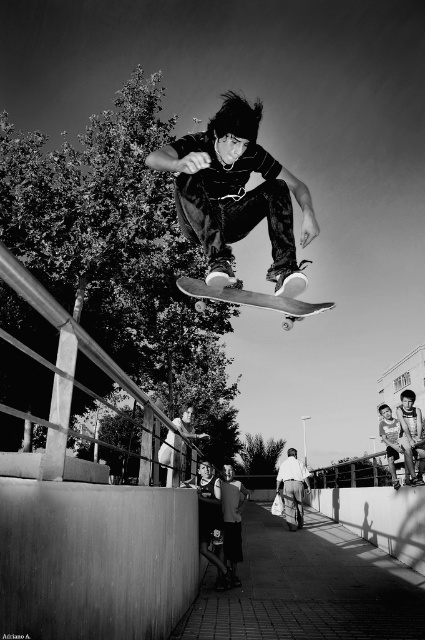
You are a photographer analyzing the composition of this black and white photo. You notice two points marked in the image. The first point is at coordinates point (x=260, y=198) and the second is at point (x=297, y=515). Based on the skateboarder and the background elements, which point is closer to the photographer?

Point (x=260, y=198) is in front of point (x=297, y=515), so the first point is closer to the photographer.

You are a photographer trying to capture the skateboarder midair. You notice two skateboards in the frame, a matte black skateboard at center and a wooden skateboard at center. Which skateboard is closer to the camera based on their height in the image?

Result: The matte black skateboard at center has a lesser height compared to the wooden skateboard at center, so the wooden skateboard at center is closer to the camera since objects closer to the camera appear larger in the image.